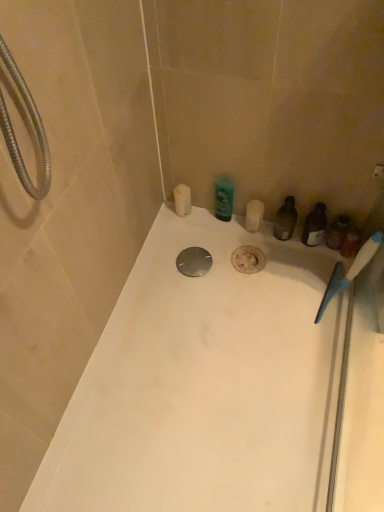
Identify the location of vacant area located to the right-hand side of white matte candle at upper left, the first toiletry from the left. (221, 229).